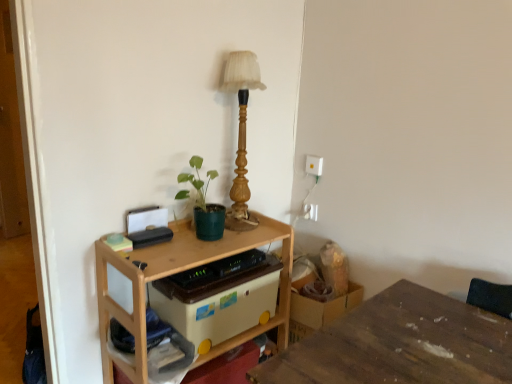
Question: From a real-world perspective, is beige plastic storage box at center under wooden table lamp at upper center?

Choices:
 (A) yes
 (B) no

Answer: (A)

Question: Is the depth of beige plastic storage box at center less than that of wooden table lamp at upper center?

Choices:
 (A) yes
 (B) no

Answer: (A)

Question: From a real-world perspective, is beige plastic storage box at center physically above wooden table lamp at upper center?

Choices:
 (A) yes
 (B) no

Answer: (B)

Question: Is the position of beige plastic storage box at center more distant than that of wooden table lamp at upper center?

Choices:
 (A) no
 (B) yes

Answer: (A)

Question: Can you confirm if beige plastic storage box at center is shorter than wooden table lamp at upper center?

Choices:
 (A) no
 (B) yes

Answer: (B)

Question: Looking at their shapes, would you say beige plastic storage box at center is wider or thinner than wooden table lamp at upper center?

Choices:
 (A) thin
 (B) wide

Answer: (B)

Question: Based on their positions, is beige plastic storage box at center located to the left or right of wooden table lamp at upper center?

Choices:
 (A) right
 (B) left

Answer: (B)

Question: Relative to wooden table lamp at upper center, is beige plastic storage box at center in front or behind?

Choices:
 (A) behind
 (B) front

Answer: (B)

Question: Which is correct: beige plastic storage box at center is inside wooden table lamp at upper center, or outside of it?

Choices:
 (A) outside
 (B) inside

Answer: (A)

Question: From a real-world perspective, is wooden table at center, arranged as the 2th table when viewed from the right, positioned above or below beige plastic storage box at center?

Choices:
 (A) above
 (B) below

Answer: (B)

Question: From their relative heights in the image, would you say wooden table at center, the first table positioned from the left, is taller or shorter than beige plastic storage box at center?

Choices:
 (A) short
 (B) tall

Answer: (B)

Question: Is point (102, 248) positioned closer to the camera than point (207, 264)?

Choices:
 (A) farther
 (B) closer

Answer: (B)

Question: Is wooden table at center, the first table positioned from the left, bigger or smaller than beige plastic storage box at center?

Choices:
 (A) big
 (B) small

Answer: (A)

Question: From a real-world perspective, relative to white plastic electric outlet at upper right, the first electric outlet ordered from the bottom, is wooden table lamp at upper center vertically above or below?

Choices:
 (A) above
 (B) below

Answer: (A)

Question: Is wooden table lamp at upper center taller or shorter than white plastic electric outlet at upper right, the 2th electric outlet from the top?

Choices:
 (A) tall
 (B) short

Answer: (A)